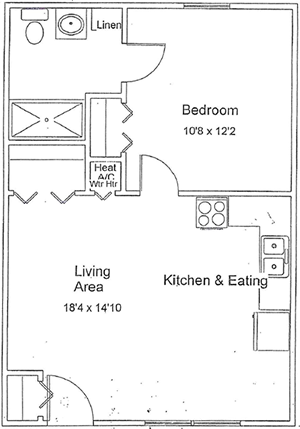
The height and width of the screenshot is (429, 300). I want to click on door, so click(x=66, y=419).